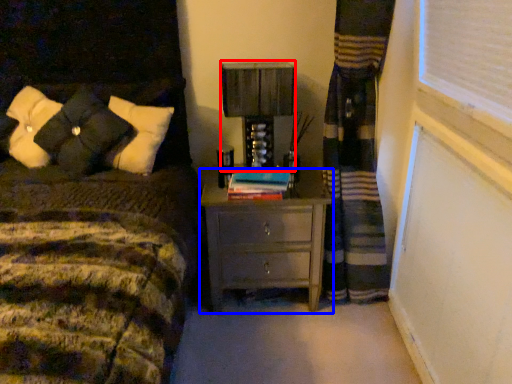
Question: Which object appears closest to the camera in this image, table lamp (highlighted by a red box) or nightstand (highlighted by a blue box)?

Choices:
 (A) table lamp
 (B) nightstand

Answer: (B)